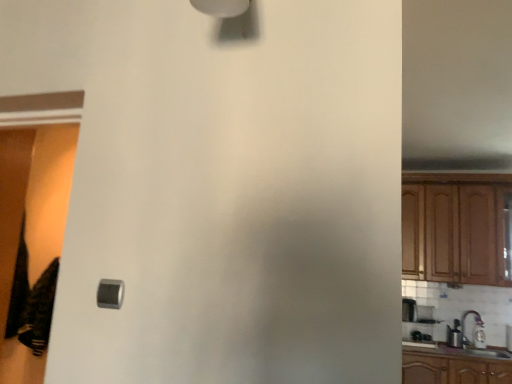
Where is `black cotton laundry at lower left`? black cotton laundry at lower left is located at coordinates (31, 301).

Describe the element at coordinates (472, 336) in the screenshot. I see `white glossy sink at lower right` at that location.

In order to face wooden cabinet at right, should I rotate leftwards or rightwards?

You should rotate right by 25.263 degrees.

Identify the location of black cotton laundry at lower left. The image size is (512, 384). (31, 301).

Can you confirm if wooden cabinet at right is smaller than black fabric screen door at left?

No.

From a real-world perspective, who is located higher, wooden cabinet at right or black fabric screen door at left?

wooden cabinet at right.

From the image's perspective, is wooden cabinet at right located above or below black fabric screen door at left?

wooden cabinet at right is situated lower than black fabric screen door at left in the image.

Between wooden cabinet at right and black fabric screen door at left, which one is positioned in front?

black fabric screen door at left.

Which of these two, satin silver switch at lower left or white glossy sink at lower right, is bigger?

With larger size is white glossy sink at lower right.

Would you say white glossy sink at lower right is part of satin silver switch at lower left's contents?

No, white glossy sink at lower right is not surrounded by satin silver switch at lower left.

Is satin silver switch at lower left turned away from white glossy sink at lower right?

No, satin silver switch at lower left's orientation is not away from white glossy sink at lower right.

Which is closer, (123, 293) or (457, 277)?

The point (123, 293) is more forward.

From a real-world perspective, which is physically above, satin silver switch at lower left or wooden cabinet at right?

wooden cabinet at right, from a real-world perspective.

Which is more to the left, satin silver switch at lower left or wooden cabinet at right?

satin silver switch at lower left.

Locate an element on the screen. Image resolution: width=512 pixels, height=384 pixels. light located on the left of wooden cabinet at right is located at coordinates (110, 293).

Which is more to the right, metallic silver toaster at right or wooden cabinet at right?

wooden cabinet at right.

Is the depth of metallic silver toaster at right greater than that of wooden cabinet at right?

Yes, it is behind wooden cabinet at right.

Based on the photo, from the image's perspective, is metallic silver toaster at right under wooden cabinet at right?

Yes.

Is point (405, 314) farther from viewer compared to point (438, 215)?

Yes, it is behind point (438, 215).

Which point is more distant from viewer, (106, 287) or (31, 194)?

Point (31, 194)

The height and width of the screenshot is (384, 512). Find the location of `light on the right of black fabric screen door at left`. light on the right of black fabric screen door at left is located at coordinates (110, 293).

Which object is wider, satin silver switch at lower left or black fabric screen door at left?

With larger width is black fabric screen door at left.

Is metallic silver toaster at right positioned far away from white glossy sink at lower right?

They are positioned close to each other.

Considering the sizes of metallic silver toaster at right and white glossy sink at lower right in the image, is metallic silver toaster at right bigger or smaller than white glossy sink at lower right?

metallic silver toaster at right is smaller than white glossy sink at lower right.

Is metallic silver toaster at right in front of white glossy sink at lower right?

No.

From a real-world perspective, is white glossy sink at lower right physically above black fabric screen door at left?

Actually, white glossy sink at lower right is physically below black fabric screen door at left in the real world.

In the scene shown: From the image's perspective, is white glossy sink at lower right beneath black fabric screen door at left?

Yes, from the image's perspective, white glossy sink at lower right is below black fabric screen door at left.

Find the location of a particular element. sink on the right of black fabric screen door at left is located at coordinates (472, 336).

You are a GUI agent. You are given a task and a screenshot of the screen. Output one action in this format:
    pyautogui.click(x=<x>, y=<y>)
    Task: Click on the cabinetry that is behind the black fabric screen door at left
    This screenshot has width=512, height=384.
    Given the screenshot: What is the action you would take?
    pyautogui.click(x=457, y=228)

In the image, there is a satin silver switch at lower left. Identify the location of sink below it (from the image's perspective). The width and height of the screenshot is (512, 384). (472, 336).

Based on the photo, which object lies further to the anchor point black fabric screen door at left, white glossy sink at lower right or satin silver switch at lower left?

white glossy sink at lower right lies further to black fabric screen door at left than the other object.

From the image, which object appears to be nearer to black cotton laundry at lower left, black fabric screen door at left or satin silver switch at lower left?

black fabric screen door at left.

Looking at the image, which one is located closer to satin silver switch at lower left, white glossy sink at lower right or wooden cabinet at right?

wooden cabinet at right is closer to satin silver switch at lower left.

Based on their spatial positions, is metallic silver toaster at right or white glossy sink at lower right further from black fabric screen door at left?

The object further to black fabric screen door at left is white glossy sink at lower right.

When comparing their distances from metallic silver toaster at right, does satin silver switch at lower left or black fabric screen door at left seem further?

Based on the image, satin silver switch at lower left appears to be further to metallic silver toaster at right.

Looking at the image, which one is located further to satin silver switch at lower left, black cotton laundry at lower left or black fabric screen door at left?

black cotton laundry at lower left is positioned further to the anchor satin silver switch at lower left.

When comparing their distances from white glossy sink at lower right, does satin silver switch at lower left or black fabric screen door at left seem closer?

The object closer to white glossy sink at lower right is black fabric screen door at left.

Based on their spatial positions, is white glossy sink at lower right or black cotton laundry at lower left further from black fabric screen door at left?

white glossy sink at lower right is positioned further to the anchor black fabric screen door at left.

The image size is (512, 384). I want to click on appliance situated between black fabric screen door at left and white glossy sink at lower right from left to right, so click(409, 310).

The image size is (512, 384). Identify the location of light between black fabric screen door at left and wooden cabinet at right. (110, 293).

Locate an element on the screen. The height and width of the screenshot is (384, 512). screen door between black cotton laundry at lower left and wooden cabinet at right is located at coordinates tap(31, 240).

Where is `light located between black fabric screen door at left and metallic silver toaster at right in the left-right direction`? Image resolution: width=512 pixels, height=384 pixels. light located between black fabric screen door at left and metallic silver toaster at right in the left-right direction is located at coordinates (110, 293).